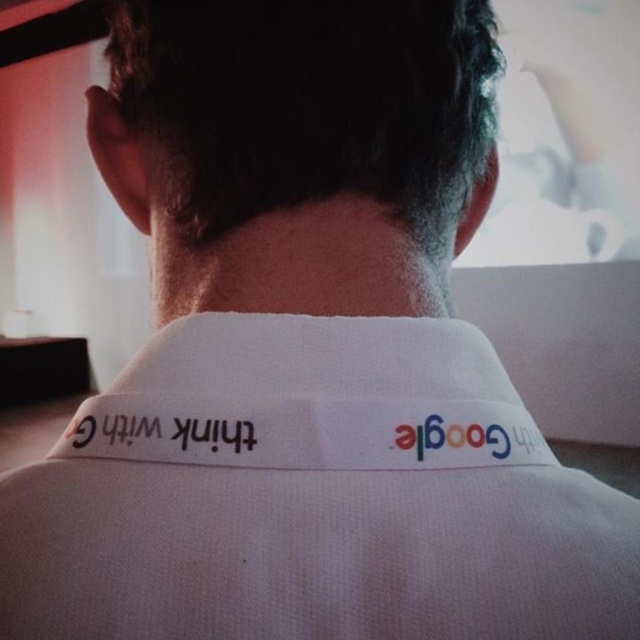
Identify the location of white fabric neckband at center. This screenshot has width=640, height=640. (310, 397).

Looking at this image, who is more distant from viewer, (204, 404) or (161, 422)?

Positioned behind is point (161, 422).

Locate an element on the screen. white fabric neckband at center is located at coordinates (310, 397).